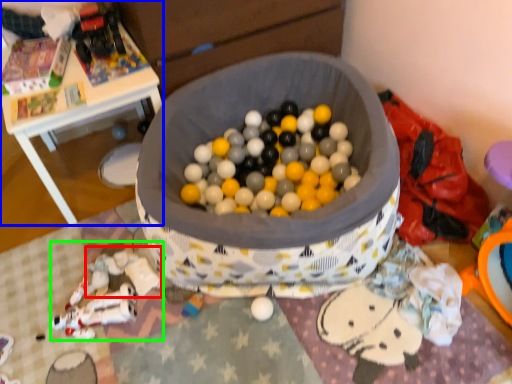
Question: Estimate the real-world distances between objects in this image. Which object is farther from toy (highlighted by a red box), table (highlighted by a blue box) or toy (highlighted by a green box)?

Choices:
 (A) table
 (B) toy

Answer: (A)